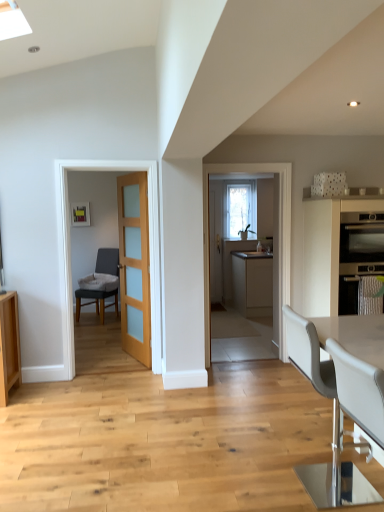
You are a GUI agent. You are given a task and a screenshot of the screen. Output one action in this format:
    pyautogui.click(x=<x>, y=<y>)
    Task: Click on the vacant point to the left of white leather chair at lower right, placed as the second chair when sorted from front to back
    The width and height of the screenshot is (384, 512).
    Given the screenshot: What is the action you would take?
    pyautogui.click(x=254, y=479)